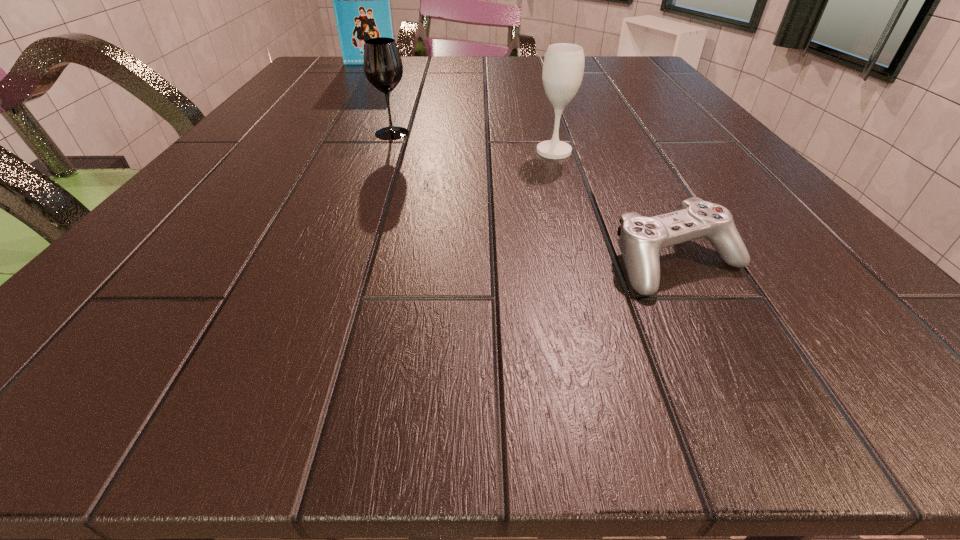
Where is `free location that satisfies the following two spatial constraints: 1. on the front cover of the leftmost object; 2. on the left side of the control`? The height and width of the screenshot is (540, 960). free location that satisfies the following two spatial constraints: 1. on the front cover of the leftmost object; 2. on the left side of the control is located at coordinates (244, 262).

Where is `blank space that satisfies the following two spatial constraints: 1. on the front cover of the tallest object; 2. on the left side of the shortest object`? The image size is (960, 540). blank space that satisfies the following two spatial constraints: 1. on the front cover of the tallest object; 2. on the left side of the shortest object is located at coordinates (244, 262).

At what (x,y) coordinates should I click in order to perform the action: click on free point that satisfies the following two spatial constraints: 1. on the front cover of the nearer wineglass; 2. on the right side of the farthest object. Please return your answer as a coordinate pair (x, y). This screenshot has height=540, width=960. Looking at the image, I should click on (315, 151).